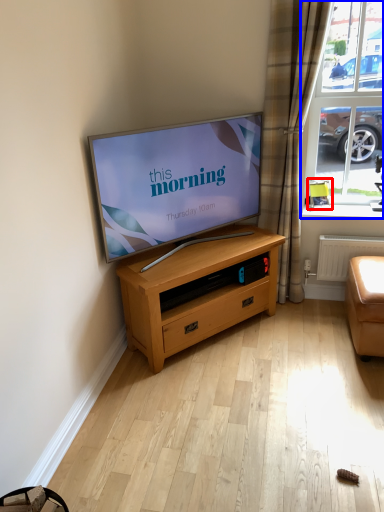
Question: Which object appears closest to the camera in this image, armchair (highlighted by a red box) or window (highlighted by a blue box)?

Choices:
 (A) armchair
 (B) window

Answer: (B)